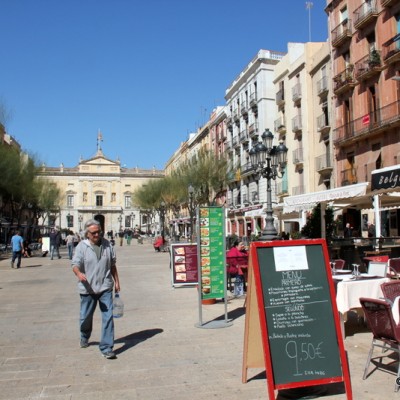
This screenshot has height=400, width=400. In order to click on text on chalkboard in this screenshot , I will do `click(296, 299)`.